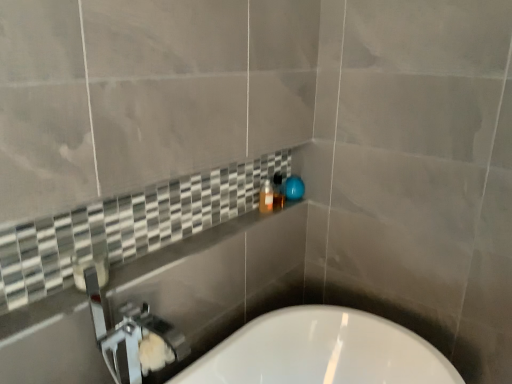
Question: Is white glossy bathtub at lower center at the right side of translucent plastic bottle at upper center?

Choices:
 (A) no
 (B) yes

Answer: (B)

Question: Can you confirm if white glossy bathtub at lower center is thinner than translucent plastic bottle at upper center?

Choices:
 (A) yes
 (B) no

Answer: (B)

Question: Is white glossy bathtub at lower center facing towards translucent plastic bottle at upper center?

Choices:
 (A) no
 (B) yes

Answer: (A)

Question: Does white glossy bathtub at lower center have a greater height compared to translucent plastic bottle at upper center?

Choices:
 (A) yes
 (B) no

Answer: (A)

Question: Is white glossy bathtub at lower center further to the viewer compared to translucent plastic bottle at upper center?

Choices:
 (A) yes
 (B) no

Answer: (B)

Question: In terms of size, does white glossy bathtub at lower center appear bigger or smaller than matte black soap dispenser at center?

Choices:
 (A) small
 (B) big

Answer: (B)

Question: Does point (348, 339) appear closer or farther from the camera than point (281, 193)?

Choices:
 (A) farther
 (B) closer

Answer: (B)

Question: Considering the relative positions of white glossy bathtub at lower center and matte black soap dispenser at center in the image provided, is white glossy bathtub at lower center to the left or to the right of matte black soap dispenser at center?

Choices:
 (A) left
 (B) right

Answer: (B)

Question: From the image's perspective, is white glossy bathtub at lower center located above or below matte black soap dispenser at center?

Choices:
 (A) above
 (B) below

Answer: (B)

Question: Considering the positions of point (265, 183) and point (316, 321), is point (265, 183) closer or farther from the camera than point (316, 321)?

Choices:
 (A) farther
 (B) closer

Answer: (A)

Question: In terms of width, does translucent plastic bottle at upper center look wider or thinner when compared to white glossy bathtub at lower center?

Choices:
 (A) wide
 (B) thin

Answer: (B)

Question: From the image's perspective, is translucent plastic bottle at upper center positioned above or below white glossy bathtub at lower center?

Choices:
 (A) above
 (B) below

Answer: (A)

Question: Considering the positions of translucent plastic bottle at upper center and white glossy bathtub at lower center in the image, is translucent plastic bottle at upper center taller or shorter than white glossy bathtub at lower center?

Choices:
 (A) tall
 (B) short

Answer: (B)

Question: From the image's perspective, is white glossy bathtub at lower center above or below translucent plastic bottle at upper center?

Choices:
 (A) above
 (B) below

Answer: (B)

Question: Is white glossy bathtub at lower center bigger or smaller than translucent plastic bottle at upper center?

Choices:
 (A) small
 (B) big

Answer: (B)